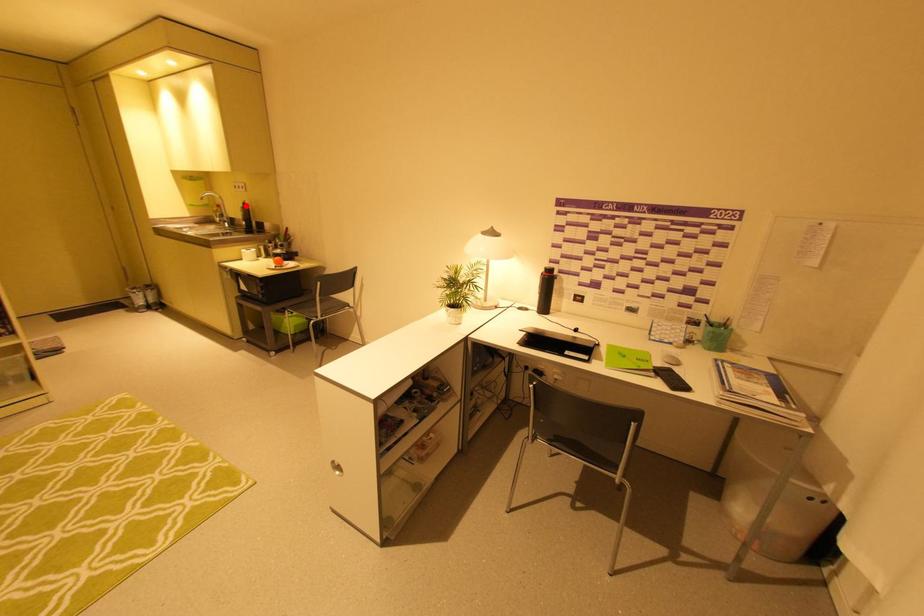
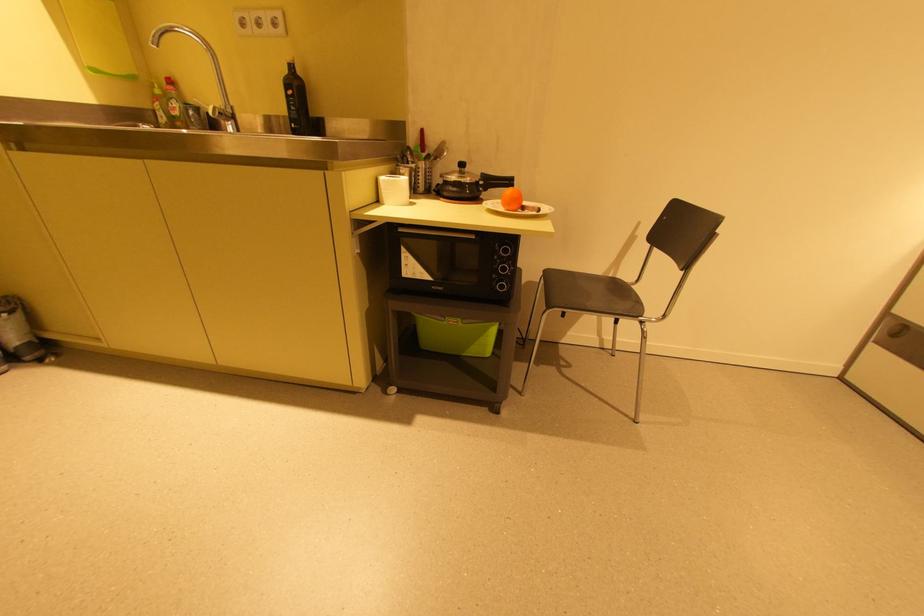
Question: I am providing you with two images of the same scene from different viewpoints. Image1 has a red point marked. In image2, the corresponding 3D location appears at what relative position? Reply with the corresponding letter.

Choices:
 (A) Closer
 (B) Farther

Answer: (B)